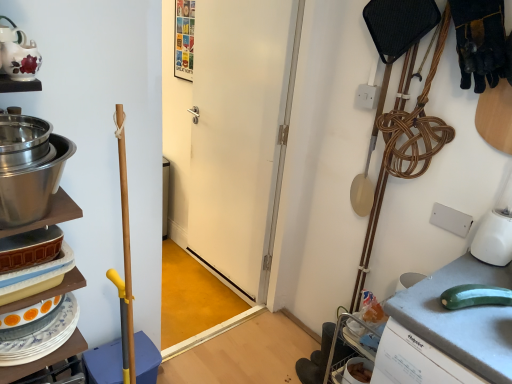
Question: Looking at their shapes, would you say white matte door at center is wider or thinner than matte ceramic teapot at upper left?

Choices:
 (A) wide
 (B) thin

Answer: (B)

Question: In terms of height, does white matte door at center look taller or shorter compared to matte ceramic teapot at upper left?

Choices:
 (A) short
 (B) tall

Answer: (B)

Question: Which object is positioned closest to the white matte door at center?

Choices:
 (A) stainless steel bowl at left
 (B) green rubber at right
 (C) matte ceramic teapot at upper left

Answer: (B)

Question: Which object is the farthest from the matte ceramic teapot at upper left?

Choices:
 (A) green rubber at right
 (B) stainless steel bowl at left
 (C) white matte door at center

Answer: (C)